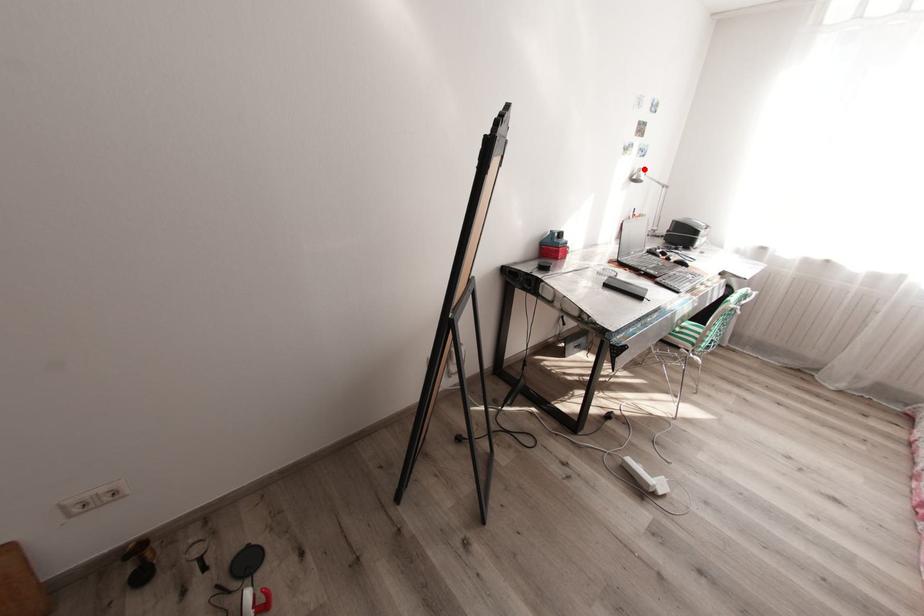
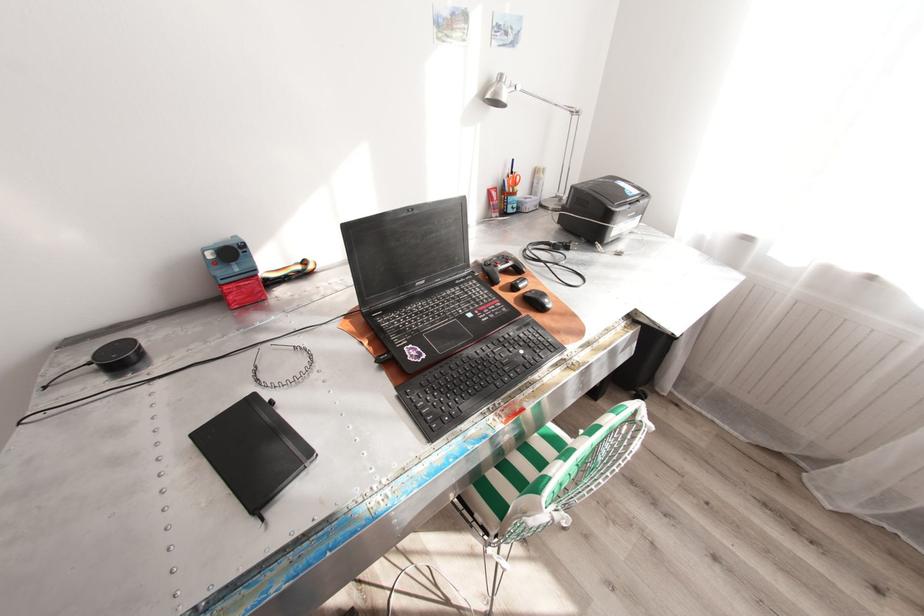
Where in the second image is the point corresponding to the highlighted location from the first image?

(505, 76)